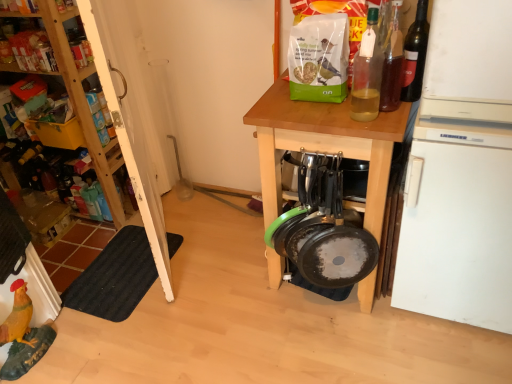
Image resolution: width=512 pixels, height=384 pixels. Find the location of `vacant region to the left of wooden table at center`. vacant region to the left of wooden table at center is located at coordinates (223, 273).